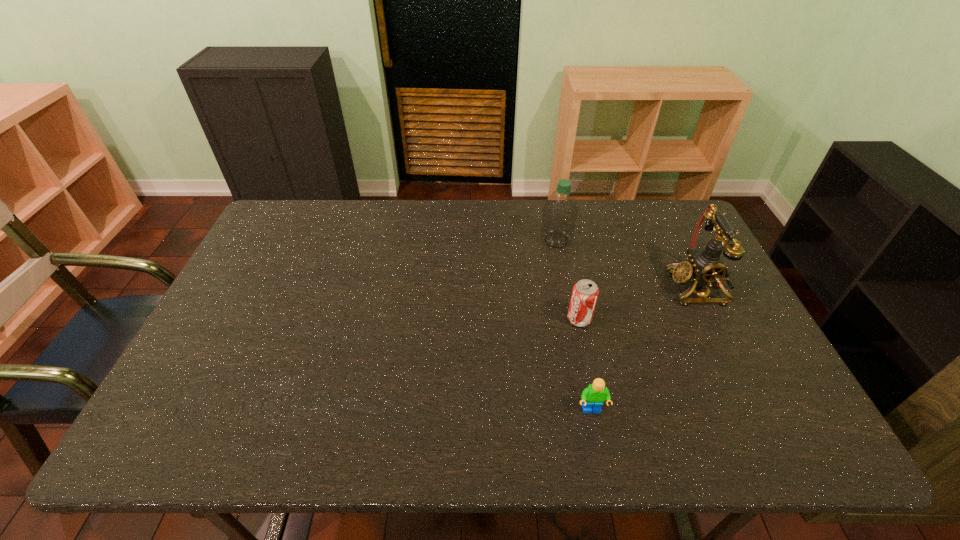
The height and width of the screenshot is (540, 960). What are the coordinates of `object that stands as the closest to the third tallest object` in the screenshot? It's located at (592, 397).

I want to click on vacant region that satisfies the following two spatial constraints: 1. on the front of the telephone, featuring the rotary dial; 2. on the face of the shortest object, so click(756, 410).

This screenshot has width=960, height=540. Find the location of `free spot that satisfies the following two spatial constraints: 1. on the front of the telephone, featuring the rotary dial; 2. on the face of the shortest object`. free spot that satisfies the following two spatial constraints: 1. on the front of the telephone, featuring the rotary dial; 2. on the face of the shortest object is located at coordinates (756, 410).

Image resolution: width=960 pixels, height=540 pixels. In order to click on blank area in the image that satisfies the following two spatial constraints: 1. on the front of the telephone, featuring the rotary dial; 2. on the face of the Lego in this screenshot , I will do `click(756, 410)`.

The height and width of the screenshot is (540, 960). In order to click on vacant region that satisfies the following two spatial constraints: 1. on the front of the rightmost object, featuring the rotary dial; 2. on the face of the nearest object in this screenshot , I will do `click(756, 410)`.